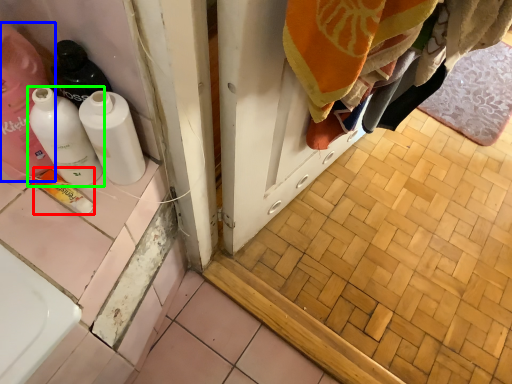
Question: Based on their relative distances, which object is nearer to product (highlighted by a red box)? Choose from cleaning product (highlighted by a blue box) and bottle (highlighted by a green box).

Choices:
 (A) cleaning product
 (B) bottle

Answer: (B)